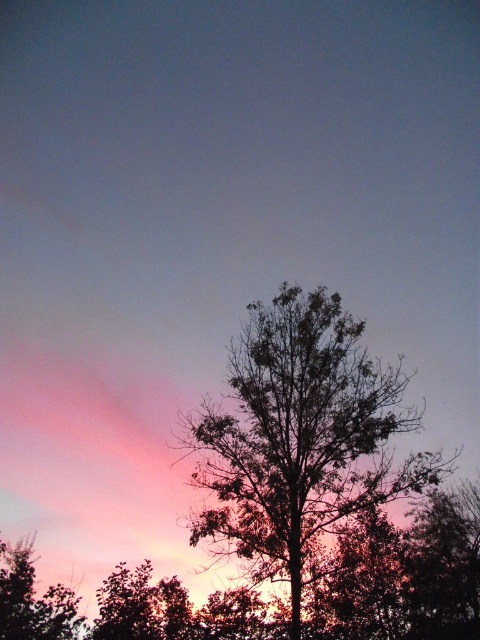
Question: Is silhouette leafy tree at center to the right of green leafy tree at lower left from the viewer's perspective?

Choices:
 (A) no
 (B) yes

Answer: (B)

Question: Which of the following is the farthest from the observer?

Choices:
 (A) (4, 600)
 (B) (194, 544)

Answer: (A)

Question: Which of the following is the closest to the observer?

Choices:
 (A) (279, 465)
 (B) (15, 630)

Answer: (A)

Question: Does silhouette leafy tree at center have a smaller size compared to green leafy tree at lower left?

Choices:
 (A) no
 (B) yes

Answer: (A)

Question: Among these points, which one is farthest from the camera?

Choices:
 (A) (331, 378)
 (B) (4, 547)

Answer: (B)

Question: In this image, where is silhouette leafy tree at center located relative to green leafy tree at lower left?

Choices:
 (A) left
 (B) right

Answer: (B)